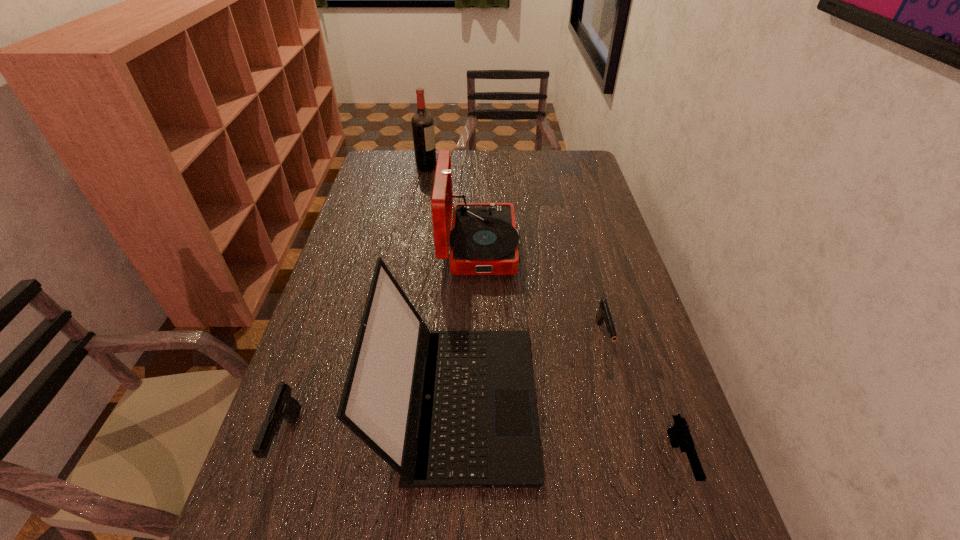
This screenshot has height=540, width=960. I want to click on blank space located on the surface of the laptop, so click(x=650, y=401).

Find the location of a particular element. This screenshot has width=960, height=540. vacant space located aim along the barrel of the tallest pistol is located at coordinates (255, 531).

The image size is (960, 540). In order to click on blank space located at the muzzle of the fifth object from left to right in this screenshot , I will do `click(616, 386)`.

Find the location of a particular element. This screenshot has width=960, height=540. object positioned at the far edge is located at coordinates [x=422, y=122].

Where is `object that is at the left edge`? object that is at the left edge is located at coordinates (282, 405).

What are the coordinates of `vacant point at the far edge` in the screenshot? It's located at (508, 152).

Identify the location of free location at the left edge of the desktop. The image size is (960, 540). (251, 521).

Identify the location of vacant area at the right edge of the desktop. This screenshot has width=960, height=540. (590, 181).

Where is `free location at the far right corner of the desktop`? This screenshot has width=960, height=540. free location at the far right corner of the desktop is located at coordinates (568, 159).

Locate an element on the screen. This screenshot has width=960, height=540. free space that is in between the phonograph_record and the laptop is located at coordinates (468, 323).